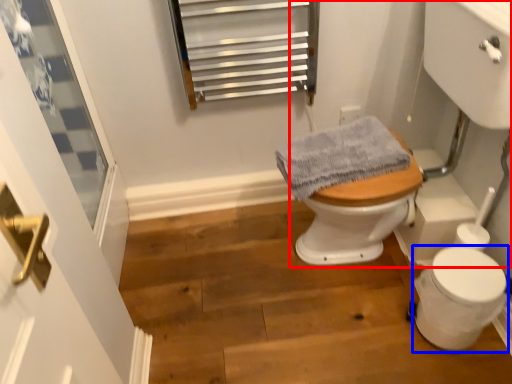
Question: Which object is closer to the camera taking this photo, sink (highlighted by a red box) or toilet bowl (highlighted by a blue box)?

Choices:
 (A) sink
 (B) toilet bowl

Answer: (A)